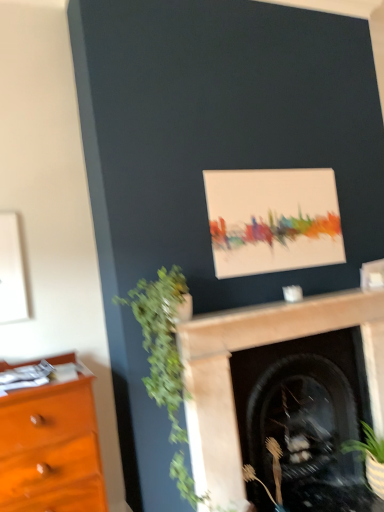
Question: Is green leafy plant at left, which is the first plant in top-to-bottom order, at the back of brown textured plant at lower center, the 2th plant when ordered from top to bottom?

Choices:
 (A) no
 (B) yes

Answer: (A)

Question: Could you tell me if brown textured plant at lower center, the 2th plant viewed from the left, is facing green leafy plant at left, placed as the second plant when sorted from bottom to top?

Choices:
 (A) yes
 (B) no

Answer: (B)

Question: Does brown textured plant at lower center, the 2th plant viewed from the left, touch green leafy plant at left, arranged as the 2th plant when viewed from the right?

Choices:
 (A) yes
 (B) no

Answer: (B)

Question: Can green leafy plant at left, arranged as the 2th plant when viewed from the right, be found inside brown textured plant at lower center, the 2th plant viewed from the left?

Choices:
 (A) yes
 (B) no

Answer: (B)

Question: From the image's perspective, is brown textured plant at lower center, acting as the first plant starting from the right, over green leafy plant at left, arranged as the 2th plant when viewed from the right?

Choices:
 (A) yes
 (B) no

Answer: (B)

Question: Is matte canvas painting at upper center situated inside green leafy plant at left, which ranks as the 1th plant in left-to-right order, or outside?

Choices:
 (A) inside
 (B) outside

Answer: (B)

Question: From a real-world perspective, is matte canvas painting at upper center physically located above or below green leafy plant at left, arranged as the 2th plant when viewed from the right?

Choices:
 (A) above
 (B) below

Answer: (A)

Question: Is matte canvas painting at upper center in front of or behind green leafy plant at left, placed as the second plant when sorted from bottom to top, in the image?

Choices:
 (A) front
 (B) behind

Answer: (B)

Question: Is matte canvas painting at upper center to the left or to the right of green leafy plant at left, which is the first plant in top-to-bottom order, in the image?

Choices:
 (A) right
 (B) left

Answer: (A)

Question: In terms of size, does brown textured plant at lower center, the 2th plant viewed from the left, appear bigger or smaller than green leafy plant at left, arranged as the 2th plant when viewed from the right?

Choices:
 (A) small
 (B) big

Answer: (A)

Question: From a real-world perspective, is brown textured plant at lower center, the 1th plant when ordered from bottom to top, above or below green leafy plant at left, which ranks as the 1th plant in left-to-right order?

Choices:
 (A) above
 (B) below

Answer: (B)

Question: Relative to green leafy plant at left, which is the first plant in top-to-bottom order, is brown textured plant at lower center, acting as the first plant starting from the right, in front or behind?

Choices:
 (A) front
 (B) behind

Answer: (B)

Question: Is brown textured plant at lower center, acting as the first plant starting from the right, to the left or to the right of green leafy plant at left, which ranks as the 1th plant in left-to-right order, in the image?

Choices:
 (A) right
 (B) left

Answer: (A)

Question: From the image's perspective, relative to brown textured plant at lower center, the 2th plant viewed from the left, is matte canvas painting at upper center above or below?

Choices:
 (A) below
 (B) above

Answer: (B)

Question: Is matte canvas painting at upper center spatially inside brown textured plant at lower center, the 2th plant viewed from the left, or outside of it?

Choices:
 (A) inside
 (B) outside

Answer: (B)